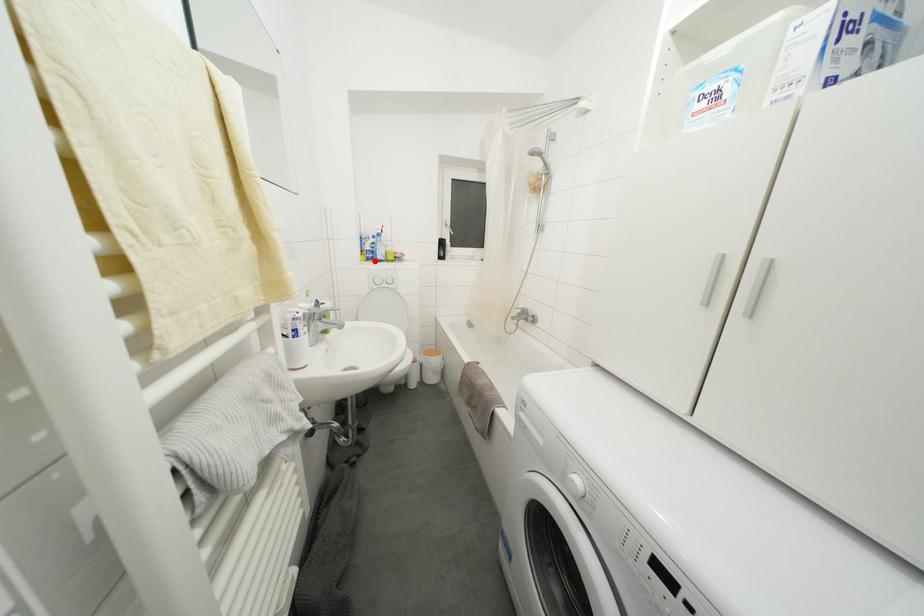
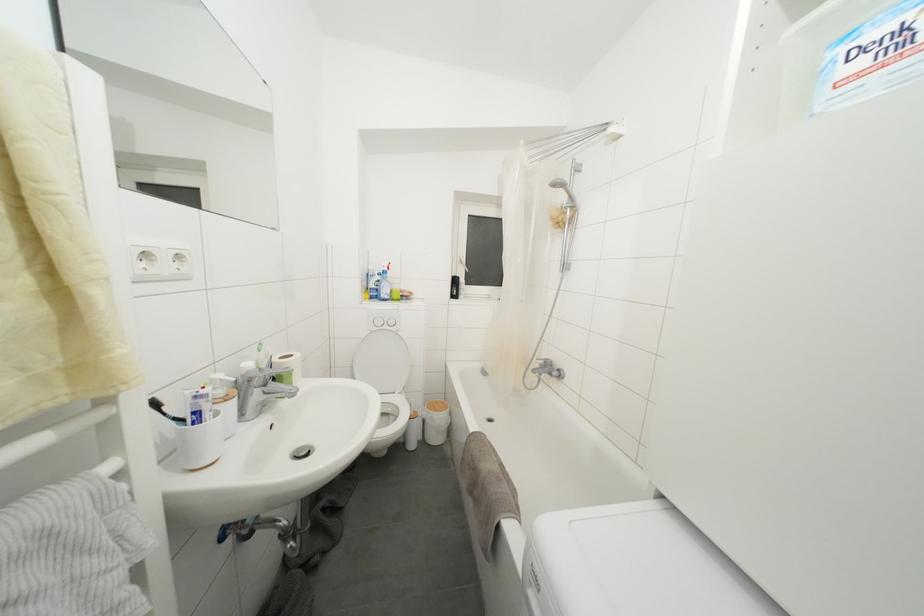
Question: I am providing you with two images of the same scene from different viewpoints. A red point is marked on the first image. At the location where the point appears in image 1, is it still visible in image 2?

Choices:
 (A) Yes
 (B) No

Answer: (A)